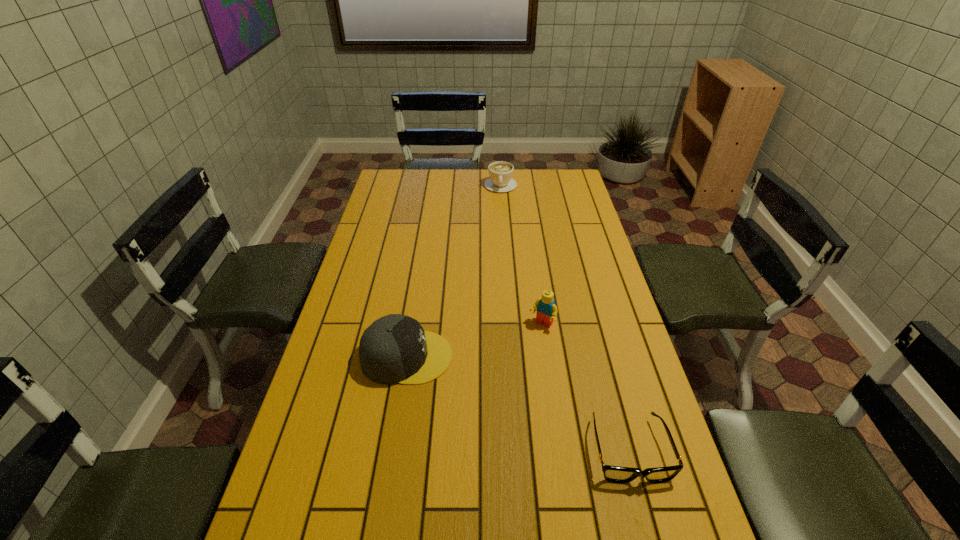
Locate an element on the screen. The width and height of the screenshot is (960, 540). vacant space on the desktop that is between the cap and the nearest object and is positioned on the front-facing side of the Lego is located at coordinates (492, 393).

You are a GUI agent. You are given a task and a screenshot of the screen. Output one action in this format:
    pyautogui.click(x=<x>, y=<y>)
    Task: Click on the vacant space on the desktop that is between the leftmost object and the shortest object and is positioned to the right of the third tallest object's handle
    This screenshot has height=540, width=960.
    Given the screenshot: What is the action you would take?
    pyautogui.click(x=516, y=403)